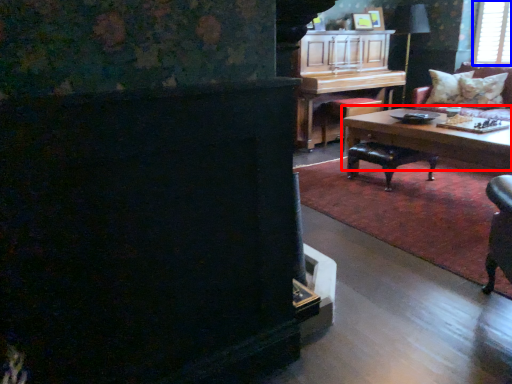
Question: Which point is further to the camera, coffee table (highlighted by a red box) or window screen (highlighted by a blue box)?

Choices:
 (A) coffee table
 (B) window screen

Answer: (B)